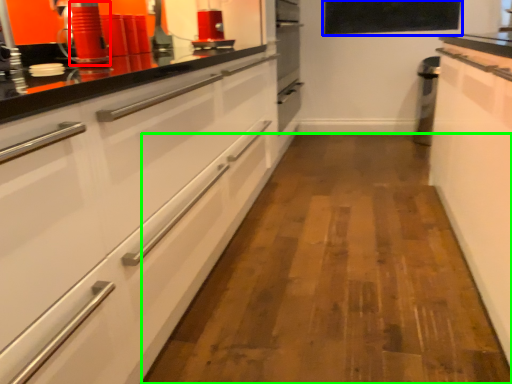
Question: Based on their relative distances, which object is farther from appliance (highlighted by a red box)? Choose from window screen (highlighted by a blue box) and plain (highlighted by a green box).

Choices:
 (A) window screen
 (B) plain

Answer: (A)